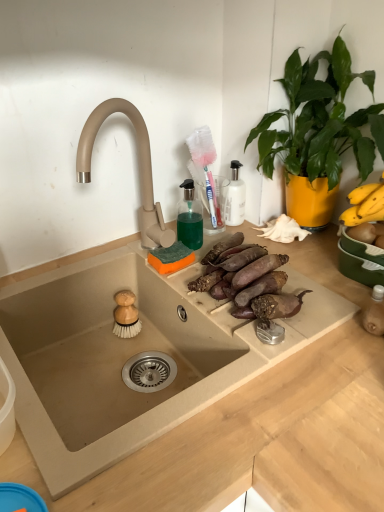
Question: Based on their positions, is green leafy plant at upper right located to the left or right of brown rough sweet potatoes at center?

Choices:
 (A) right
 (B) left

Answer: (A)

Question: Is green leafy plant at upper right inside the boundaries of brown rough sweet potatoes at center, or outside?

Choices:
 (A) inside
 (B) outside

Answer: (B)

Question: Estimate the real-world distances between objects in this image. Which object is closer to the brown rough sweet potatoes at center?

Choices:
 (A) green leafy plant at upper right
 (B) beige stone sink at center

Answer: (B)

Question: Considering the real-world distances, which object is closest to the green leafy plant at upper right?

Choices:
 (A) brown rough sweet potatoes at center
 (B) beige stone sink at center

Answer: (A)